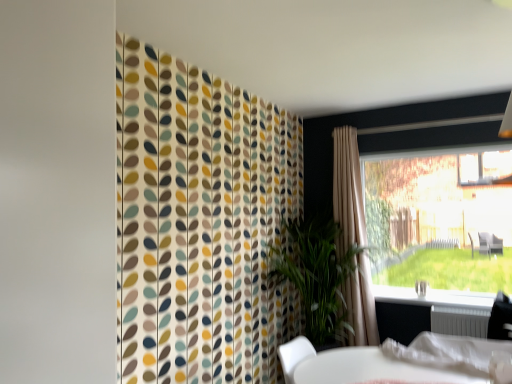
Locate an element on the screen. The width and height of the screenshot is (512, 384). free point above white metallic radiator at lower right (from a real-world perspective) is located at coordinates (458, 312).